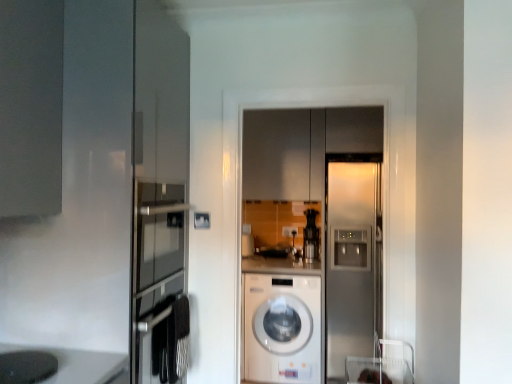
Question: Would you say white glossy washing machine at center contains black plastic coffee machine at center?

Choices:
 (A) yes
 (B) no

Answer: (B)

Question: From the image's perspective, is white glossy washing machine at center located above black plastic coffee machine at center?

Choices:
 (A) no
 (B) yes

Answer: (A)

Question: Is white glossy washing machine at center positioned beyond the bounds of black plastic coffee machine at center?

Choices:
 (A) yes
 (B) no

Answer: (A)

Question: Is white glossy washing machine at center wider than black plastic coffee machine at center?

Choices:
 (A) no
 (B) yes

Answer: (B)

Question: Considering the relative sizes of white glossy washing machine at center and black plastic coffee machine at center in the image provided, is white glossy washing machine at center shorter than black plastic coffee machine at center?

Choices:
 (A) yes
 (B) no

Answer: (B)

Question: Is black plastic coffee machine at center taller or shorter than white glossy washing machine at center?

Choices:
 (A) short
 (B) tall

Answer: (A)

Question: Does point pyautogui.click(x=311, y=243) appear closer or farther from the camera than point pyautogui.click(x=245, y=286)?

Choices:
 (A) farther
 (B) closer

Answer: (A)

Question: Is black plastic coffee machine at center in front of or behind white glossy washing machine at center in the image?

Choices:
 (A) behind
 (B) front

Answer: (A)

Question: Is black plastic coffee machine at center bigger or smaller than white glossy washing machine at center?

Choices:
 (A) big
 (B) small

Answer: (B)

Question: Is white plastic electric outlet at center inside the boundaries of white glossy washing machine at center, or outside?

Choices:
 (A) inside
 (B) outside

Answer: (B)

Question: Is point (283, 231) closer or farther from the camera than point (279, 374)?

Choices:
 (A) closer
 (B) farther

Answer: (B)

Question: From the image's perspective, is white plastic electric outlet at center above or below white glossy washing machine at center?

Choices:
 (A) above
 (B) below

Answer: (A)

Question: Considering the positions of white plastic electric outlet at center and white glossy washing machine at center in the image, is white plastic electric outlet at center wider or thinner than white glossy washing machine at center?

Choices:
 (A) thin
 (B) wide

Answer: (A)

Question: Considering the positions of matte black coffee maker at lower left and white plastic electric outlet at center in the image, is matte black coffee maker at lower left bigger or smaller than white plastic electric outlet at center?

Choices:
 (A) small
 (B) big

Answer: (B)

Question: From the image's perspective, is matte black coffee maker at lower left located above or below white plastic electric outlet at center?

Choices:
 (A) below
 (B) above

Answer: (A)